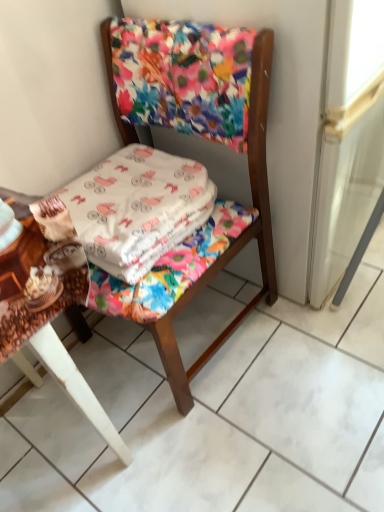
In order to click on vacant space in wooden table at lower left (from a real-world perspective) in this screenshot , I will do `click(108, 418)`.